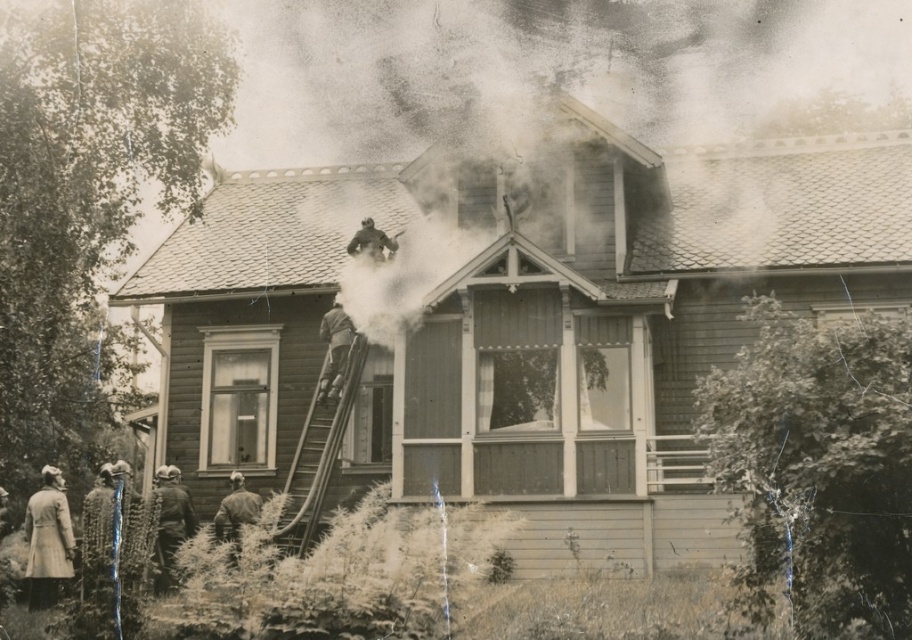
Question: Is dark brown leather jacket at lower left wider than brushed metal helmet at lower center?

Choices:
 (A) no
 (B) yes

Answer: (B)

Question: Can you confirm if light brown coat at lower left is smaller than wooden ladder at upper center?

Choices:
 (A) yes
 (B) no

Answer: (A)

Question: Which of the following is the closest to the observer?

Choices:
 (A) wooden ladder at upper center
 (B) brushed metal helmet at lower center

Answer: (B)

Question: Among these points, which one is farthest from the camera?

Choices:
 (A) (371, 234)
 (B) (50, 477)
 (C) (173, 548)

Answer: (A)

Question: Does brushed metal helmet at lower center appear under matte black helmet at upper center?

Choices:
 (A) no
 (B) yes

Answer: (B)

Question: Among these points, which one is nearest to the camera?

Choices:
 (A) (50, 467)
 (B) (229, 525)
 (C) (169, 545)

Answer: (C)